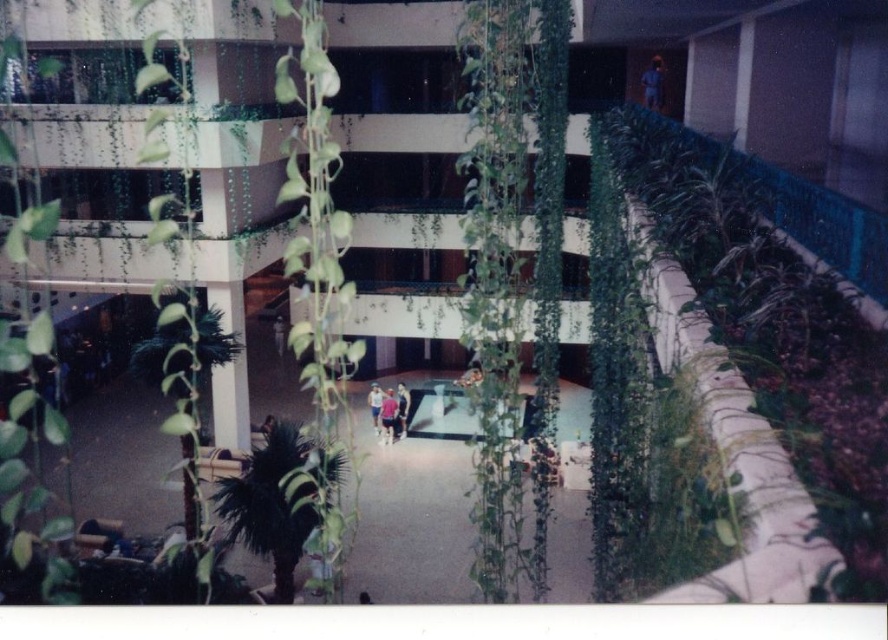
You are standing at the bottom of the atrium and see a blue fabric person at upper center and a matte pink shorts at center. Which object is located to the right when viewed from your perspective?

The blue fabric person at upper center is positioned on the right side of matte pink shorts at center, so from your perspective at the bottom, the blue fabric person at upper center is to the right.